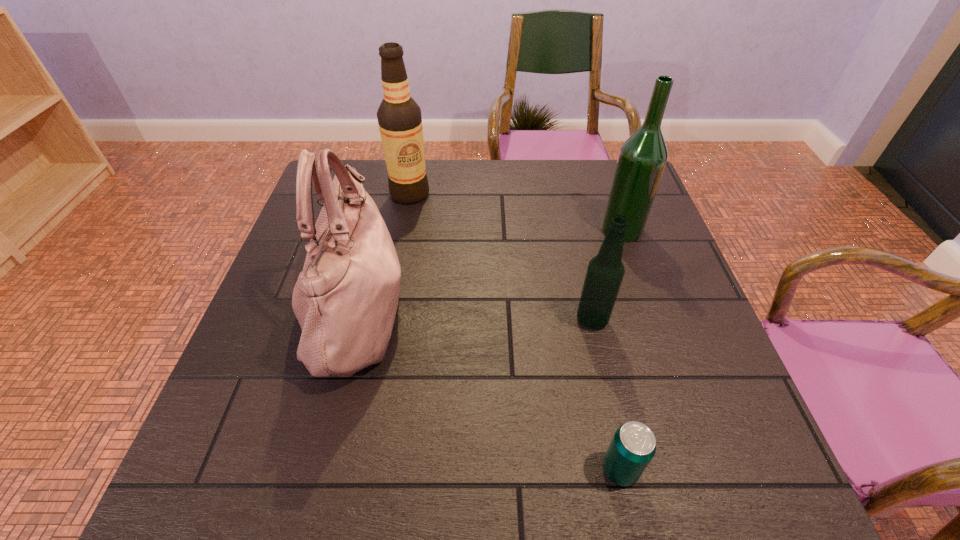
At what (x,y) coordinates should I click in order to perform the action: click on the farthest object. Please return your answer as a coordinate pair (x, y). The width and height of the screenshot is (960, 540). Looking at the image, I should click on (399, 117).

Locate an element on the screen. This screenshot has height=540, width=960. the leftmost alcohol is located at coordinates (399, 117).

Find the location of a particular element. The image size is (960, 540). the second farthest object is located at coordinates (642, 158).

Find the location of a particular element. Image resolution: width=960 pixels, height=540 pixels. the second farthest alcohol is located at coordinates (642, 158).

At what (x,y) coordinates should I click in order to perform the action: click on handbag. Please return your answer as a coordinate pair (x, y). This screenshot has height=540, width=960. Looking at the image, I should click on (345, 299).

Locate an element on the screen. The height and width of the screenshot is (540, 960). the fourth tallest object is located at coordinates (605, 272).

Locate an element on the screen. The width and height of the screenshot is (960, 540). the second alcohol from left to right is located at coordinates (605, 272).

Identify the location of the shortest object. [x=633, y=446].

Identify the location of the nearest object. This screenshot has height=540, width=960. (633, 446).

The width and height of the screenshot is (960, 540). What are the coordinates of `vacant space located 0.210m on the label of the leftmost alcohol` in the screenshot? It's located at (398, 256).